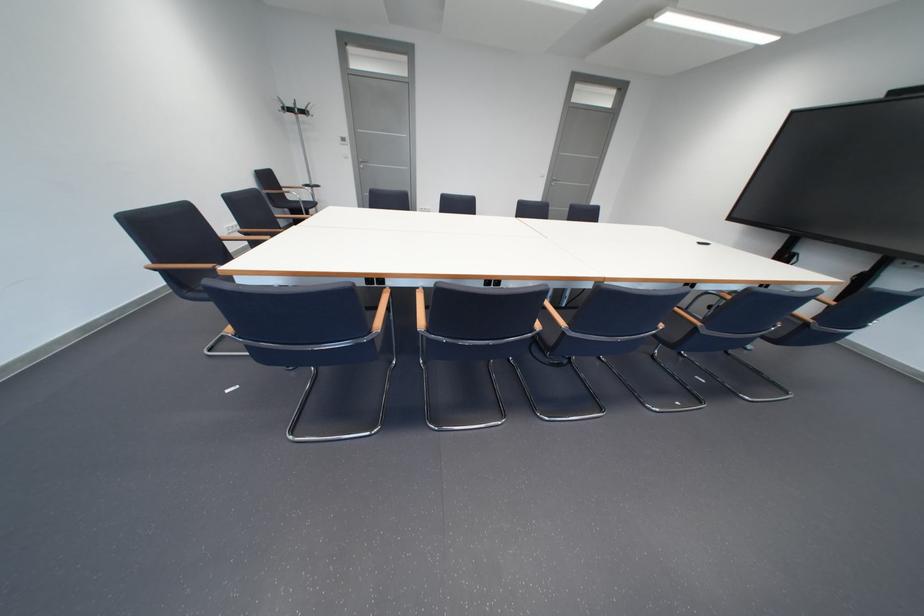
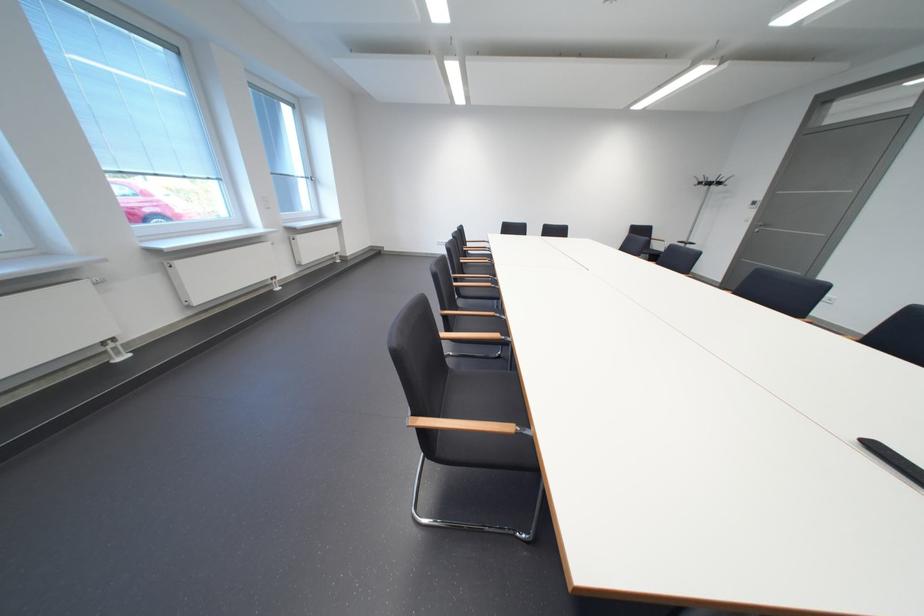
The point at (315, 114) is marked in the first image. Where is the corresponding point in the second image?

(723, 185)